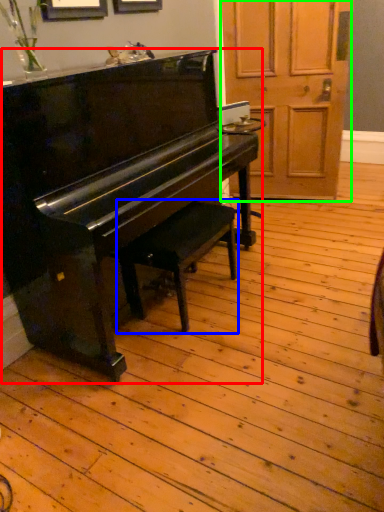
Question: Which object is the closest to the piano (highlighted by a red box)? Choose among these: music stool (highlighted by a blue box) or screen door (highlighted by a green box).

Choices:
 (A) music stool
 (B) screen door

Answer: (A)